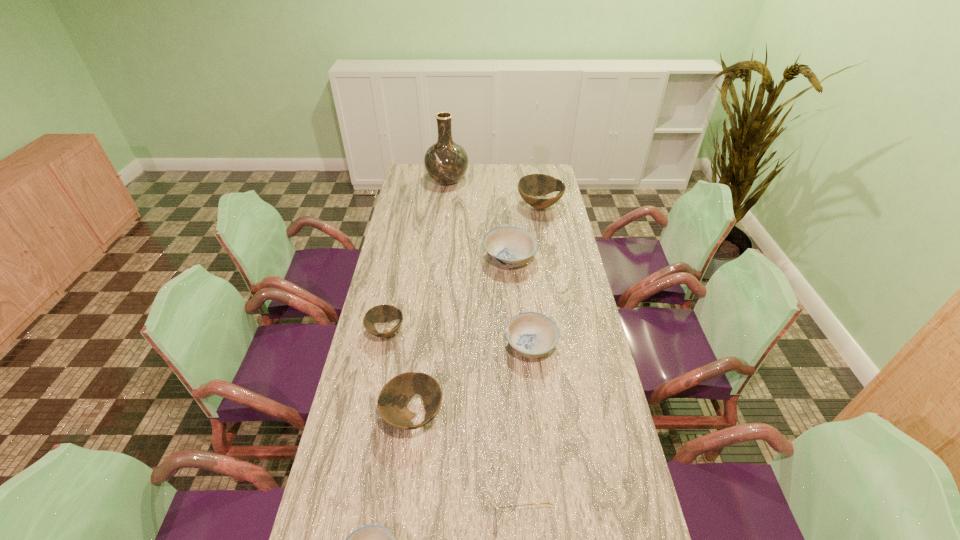
Find the location of a particular element. The image size is (960, 540). brown bowl object that ranks as the second closest to the tallest bowl is located at coordinates (392, 402).

The width and height of the screenshot is (960, 540). Identify the location of the closest blue bowl to the gold spectacles. (372, 539).

The width and height of the screenshot is (960, 540). I want to click on blue bowl identified as the closest to the vase, so click(508, 246).